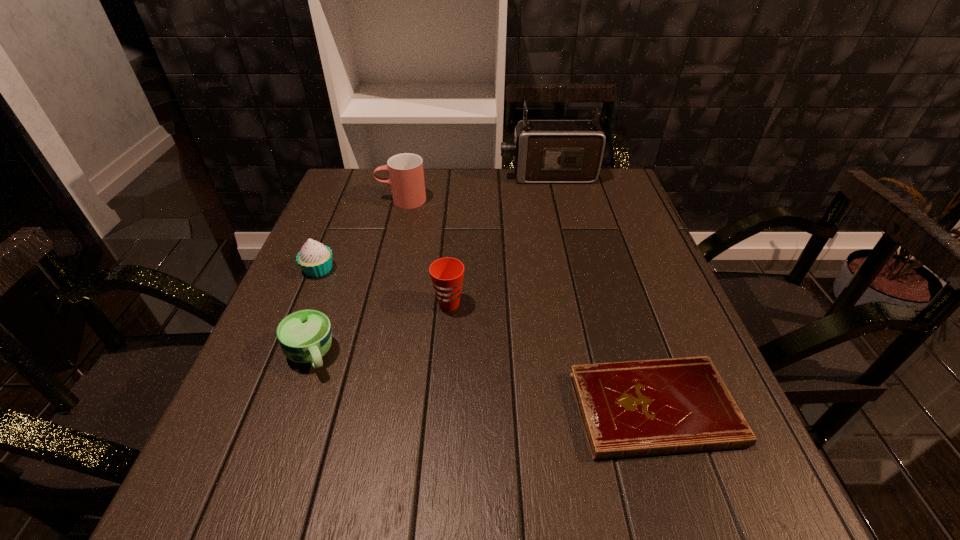
Locate an element on the screen. This screenshot has width=960, height=540. the farthest object is located at coordinates (544, 151).

Identify the location of camcorder. This screenshot has height=540, width=960. (544, 151).

Identify the location of the fifth nearest object. click(406, 175).

This screenshot has width=960, height=540. Find the location of `the second tallest object`. the second tallest object is located at coordinates (406, 175).

Find the location of a particular element. This screenshot has height=540, width=960. the rightmost cup is located at coordinates (447, 274).

This screenshot has height=540, width=960. Identify the location of the third nearest object. (447, 274).

At what (x,y) coordinates should I click in order to perform the action: click on the fourth tallest object. Please return your answer as a coordinate pair (x, y). This screenshot has height=540, width=960. Looking at the image, I should click on (315, 259).

Find the location of a particular element. The height and width of the screenshot is (540, 960). the fourth nearest object is located at coordinates (315, 259).

I want to click on the shortest cup, so (x=305, y=336).

Where is `the nearest cup`? The height and width of the screenshot is (540, 960). the nearest cup is located at coordinates (305, 336).